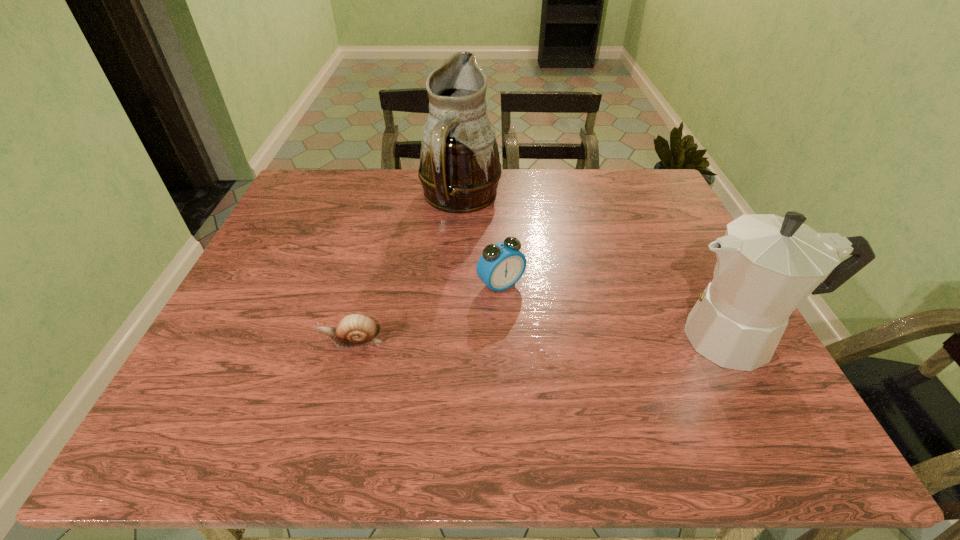
Locate an element on the screen. vacant space on the desktop that is between the leftmost object and the third shortest object and is positioned from the spout of the pitcher is located at coordinates (560, 339).

This screenshot has height=540, width=960. Find the location of `vacant spot on the desktop that is between the shortest object and the rightmost object and is positioned on the face of the third tallest object`. vacant spot on the desktop that is between the shortest object and the rightmost object and is positioned on the face of the third tallest object is located at coordinates (554, 340).